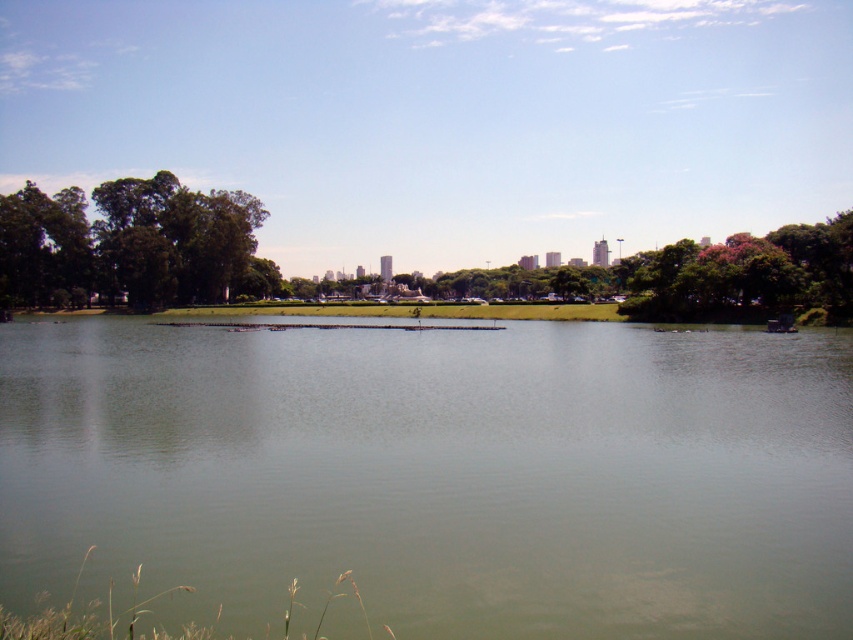
You are standing at the lakeside and want to take a photo of both the green leafy tree at left and the pink textured tree at right. Which tree should you move towards to include both in your camera frame?

To include both the green leafy tree at left and the pink textured tree at right in your camera frame, you should move towards the pink textured tree at right because the green leafy tree at left is positioned over it, meaning it is closer to you. By moving towards the farther tree, you can better frame both in your shot.

You are standing at the lakeside and want to take a photo of the pink textured tree at right without the green smooth water at center blocking the view. Is it possible to do so?

The green smooth water at center is in front of the pink textured tree at right, so you cannot take a photo of the pink textured tree at right without the green smooth water at center blocking the view.